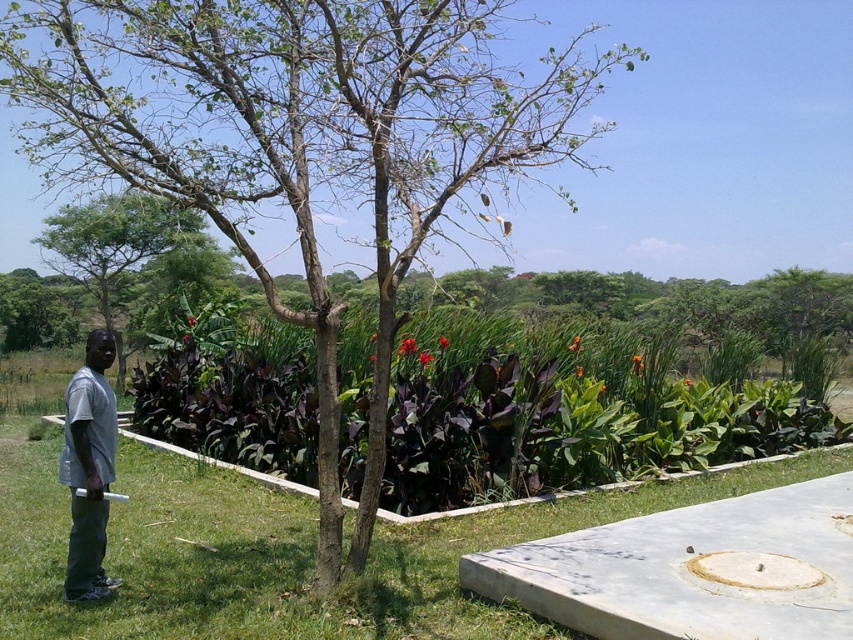
Question: Among these points, which one is farthest from the camera?

Choices:
 (A) (67, 589)
 (B) (218, 218)

Answer: (A)

Question: Does green matte tree at left appear on the left side of gray matte shirt at left?

Choices:
 (A) yes
 (B) no

Answer: (A)

Question: Estimate the real-world distances between objects in this image. Which object is closer to the gray matte shirt at left?

Choices:
 (A) green leafy tree at center
 (B) green matte tree at left

Answer: (A)

Question: In this image, where is green matte tree at left located relative to gray matte shirt at left?

Choices:
 (A) right
 (B) left

Answer: (B)

Question: Can you confirm if green leafy tree at center is positioned above gray matte shirt at left?

Choices:
 (A) yes
 (B) no

Answer: (A)

Question: Which point is closer to the camera?

Choices:
 (A) green matte tree at left
 (B) gray matte shirt at left
 (C) green leafy tree at center

Answer: (C)